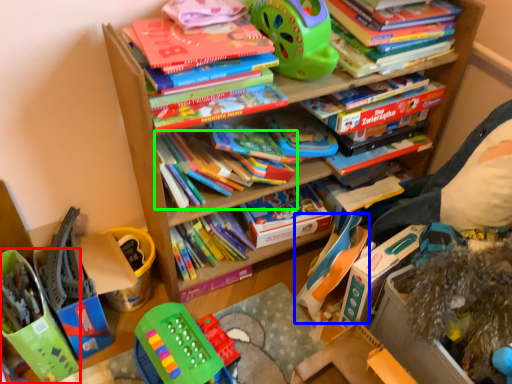
Question: Estimate the real-world distances between objects in this image. Which object is farther from toy (highlighted by a red box), toy (highlighted by a blue box) or book (highlighted by a green box)?

Choices:
 (A) toy
 (B) book

Answer: (A)